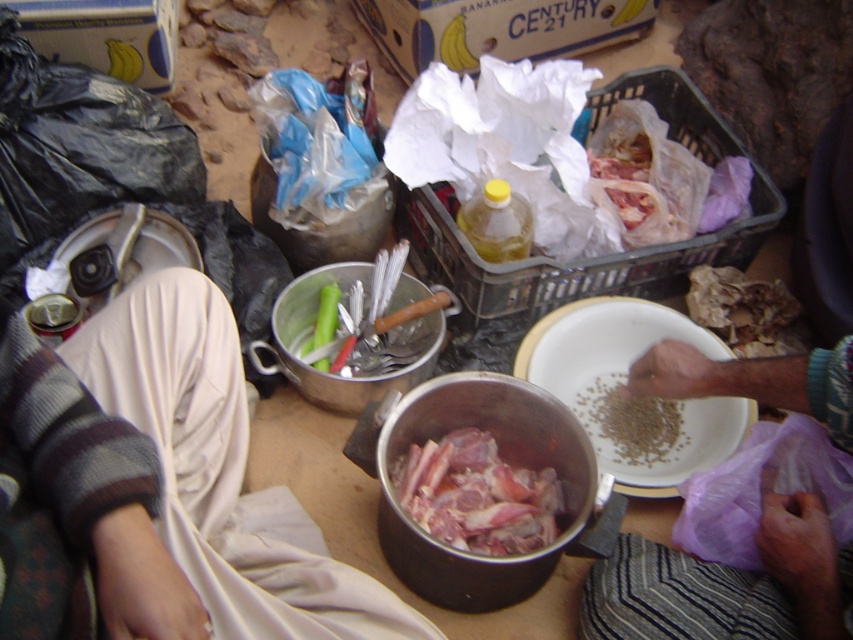
You are a chef preparing a dish and need to place both the smooth purple cloth at lower right and the brown matte seeds at center on a shelf. The shelf has a height limit of 1 meter. Can both items fit vertically without exceeding the shelf height?

The smooth purple cloth at lower right is taller than the brown matte seeds at center. However, since the exact heights are not provided, we can only confirm that both items are likely under 1 meter if the tallest item, the smooth purple cloth at lower right, is below the 1 meter limit. Without specific measurements, we cannot be certain, but assuming typical sizes for such items, they might fit.

What is the position of the smooth purple cloth at lower right in the image coordinates?

The smooth purple cloth at lower right is located at point coordinates of (727, 586).

You are a chef preparing a dish and need to decide which item to use for covering the pot. The smooth purple cloth at lower right and the white matte bowl at center are available. Which one is more suitable based on their thickness?

The smooth purple cloth at lower right is thinner than the white matte bowl at center, so it would be more suitable for covering the pot as it can conform better to the pot.